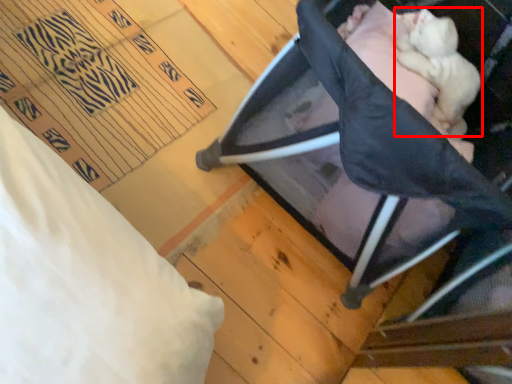
Question: In this image, where is newborn (annotated by the red box) located relative to furniture?

Choices:
 (A) left
 (B) right

Answer: (B)